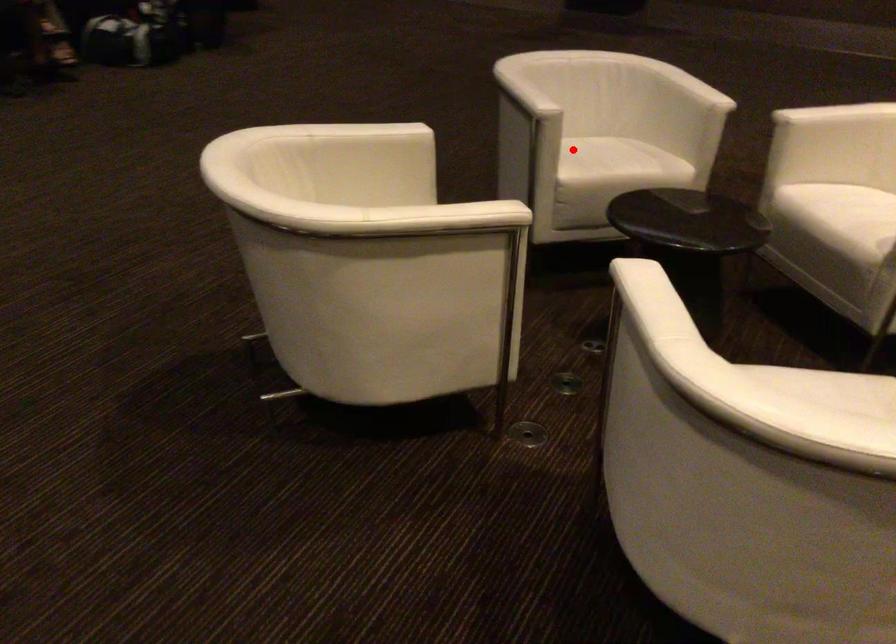
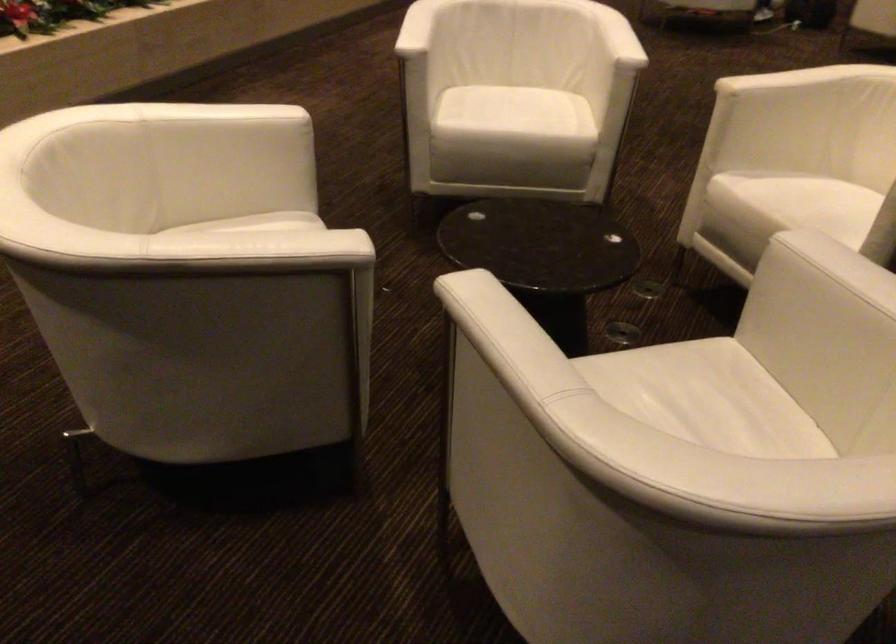
Question: I am providing you with two images of the same scene from different viewpoints. Given a red point in image1, look at the same physical point in image2. Is it:

Choices:
 (A) Closer to the viewpoint
 (B) Farther from the viewpoint

Answer: (A)